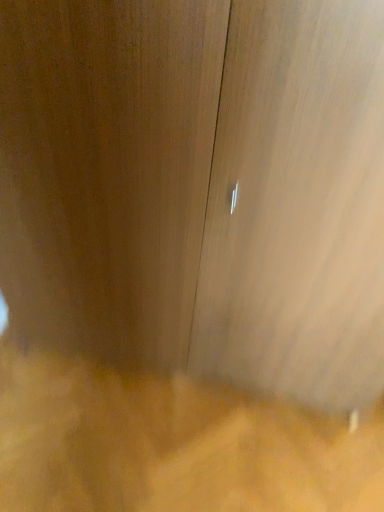
The image size is (384, 512). What do you see at coordinates (170, 446) in the screenshot?
I see `brown matte sand at lower center` at bounding box center [170, 446].

Where is `brown matte sand at lower center`? brown matte sand at lower center is located at coordinates 170,446.

Where is `brown matte sand at lower center`? The image size is (384, 512). brown matte sand at lower center is located at coordinates 170,446.